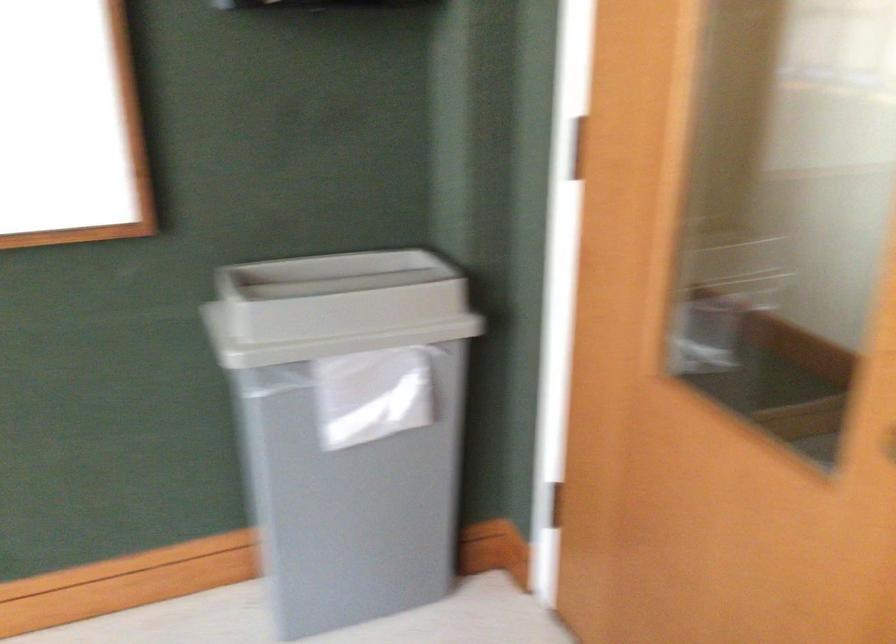
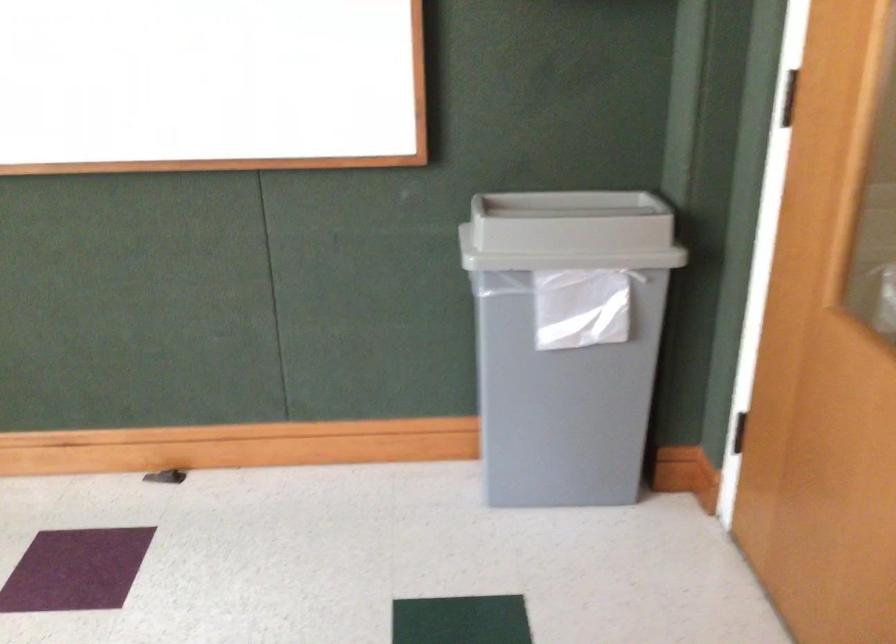
Which direction would the cameraman need to move to produce the second image?

The movement direction of the cameraman is right, backward.